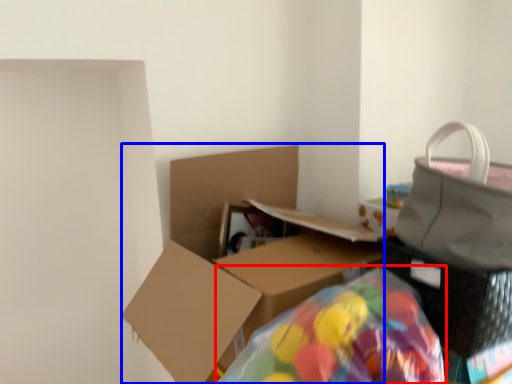
Question: Among these objects, which one is nearest to the camera, bean bag chair (highlighted by a red box) or box (highlighted by a blue box)?

Choices:
 (A) bean bag chair
 (B) box

Answer: (A)